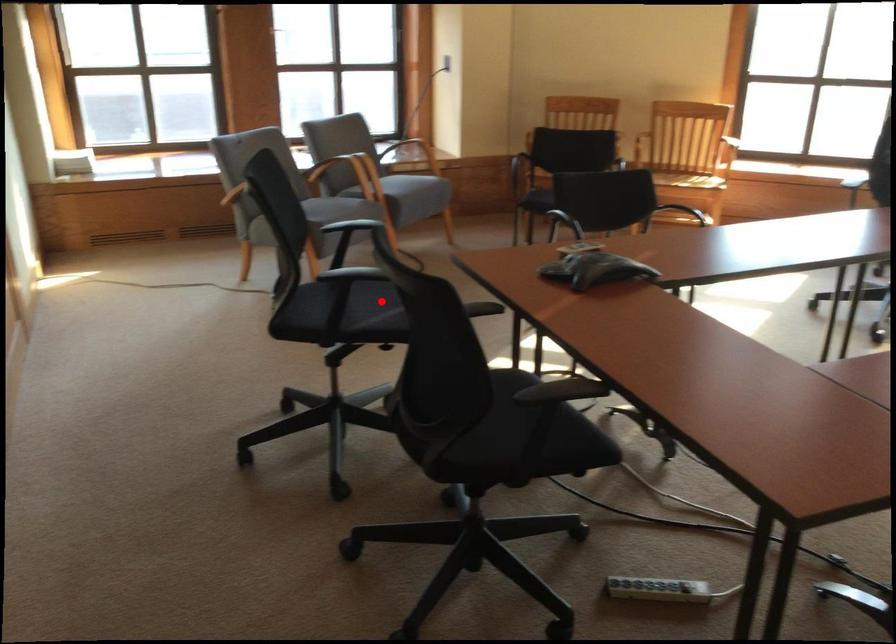
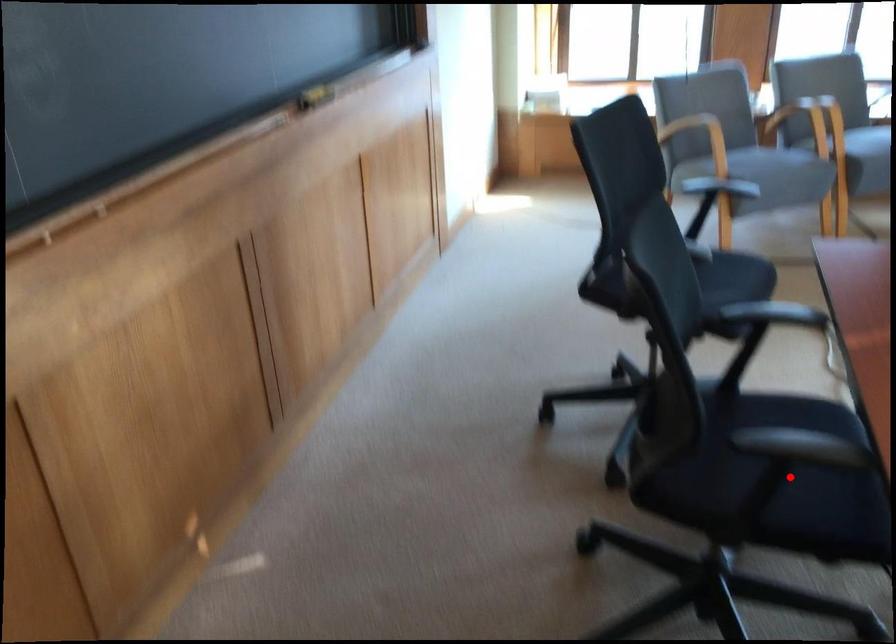
I am providing you with two images of the same scene from different viewpoints. A red point is marked on the first image and another point is marked on the second image. Is the marked point in image1 the same physical position as the marked point in image2?

No